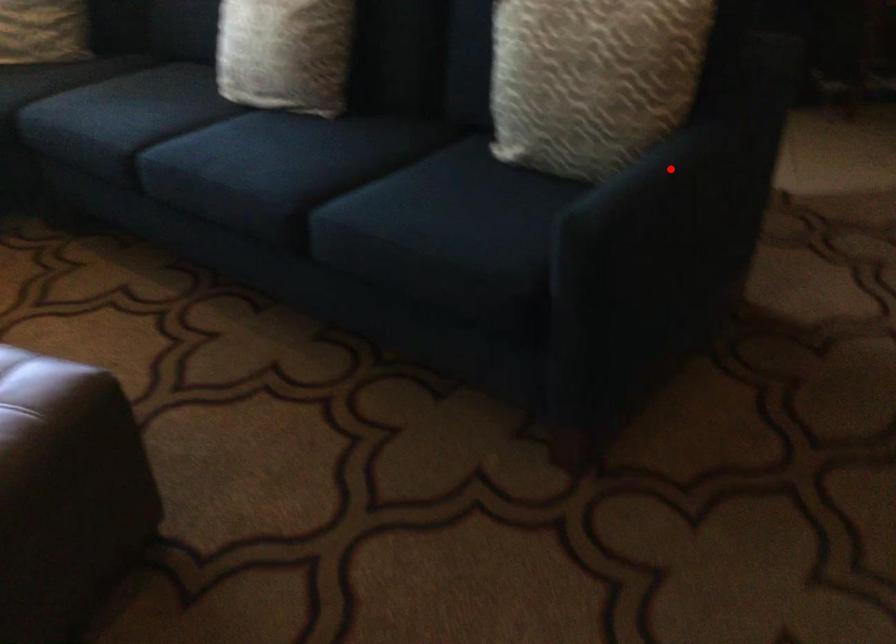
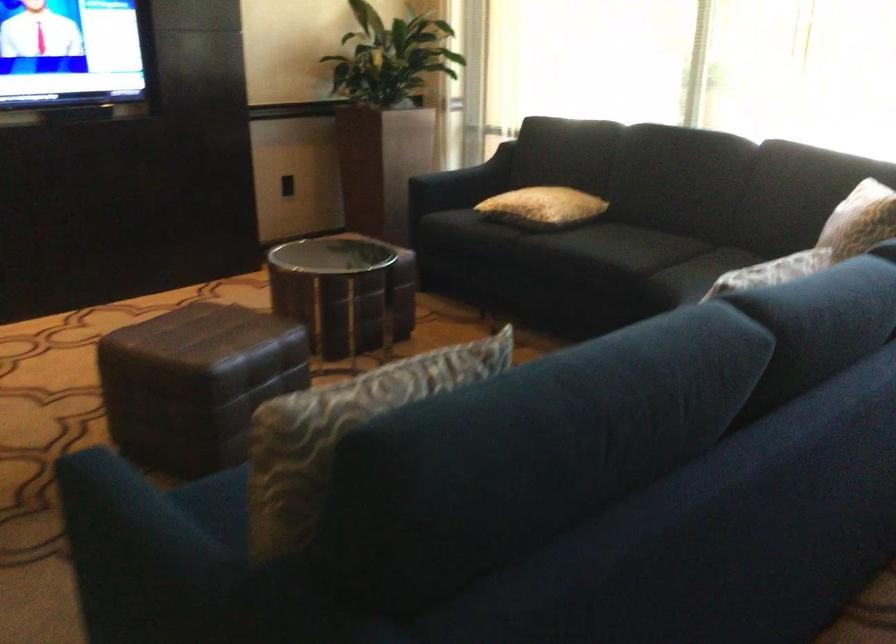
Question: I am providing you with two images of the same scene from different viewpoints. A red point is marked on the first image. Is the red point's position out of view in image 2?

Choices:
 (A) Yes
 (B) No

Answer: (B)